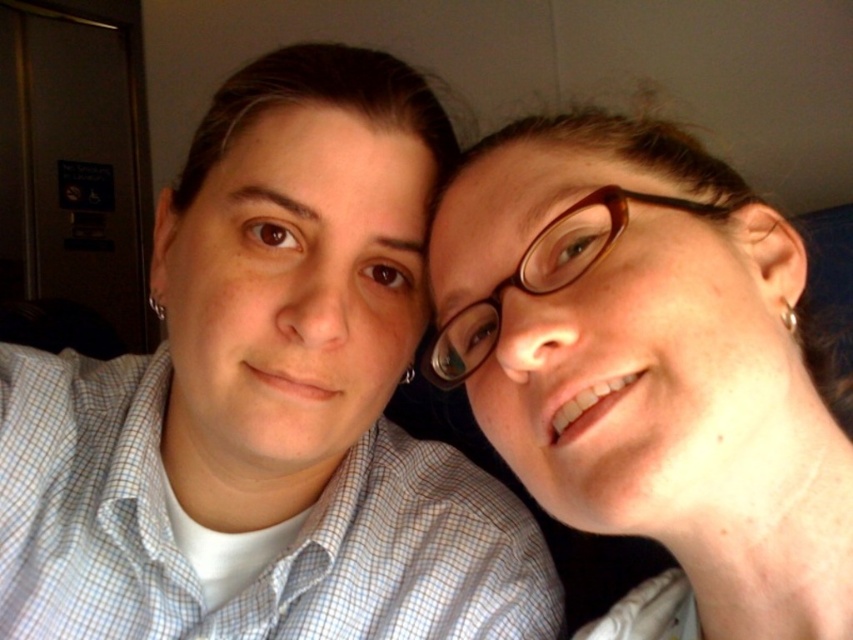
You are holding a 12 inch ruler and want to measure the distance between yourself and the brown glossy glasses at upper right in the image. Can you reach the glasses with the ruler without moving?

The distance between you and the brown glossy glasses at upper right is 13.52 inches, so the 12 inch ruler is too short to reach the glasses.

You are taking a photo of two people standing in front of you. The first person is at point (668,253) and the second is at point (427,378). Which person is closer to you?

The person at point (668,253) is closer to you than the person at point (427,378) because the point (668,253) is closer to the camera.

You are taking a photo of two people in an indoor setting. The scene includes a brown glossy glasses at upper right represented by point (650, 362). Where should you position your camera to ensure the glasses are centered in the frame?

To center the brown glossy glasses at upper right in the frame, position the camera so that the point (650, 362) aligns with the center of the viewfinder.